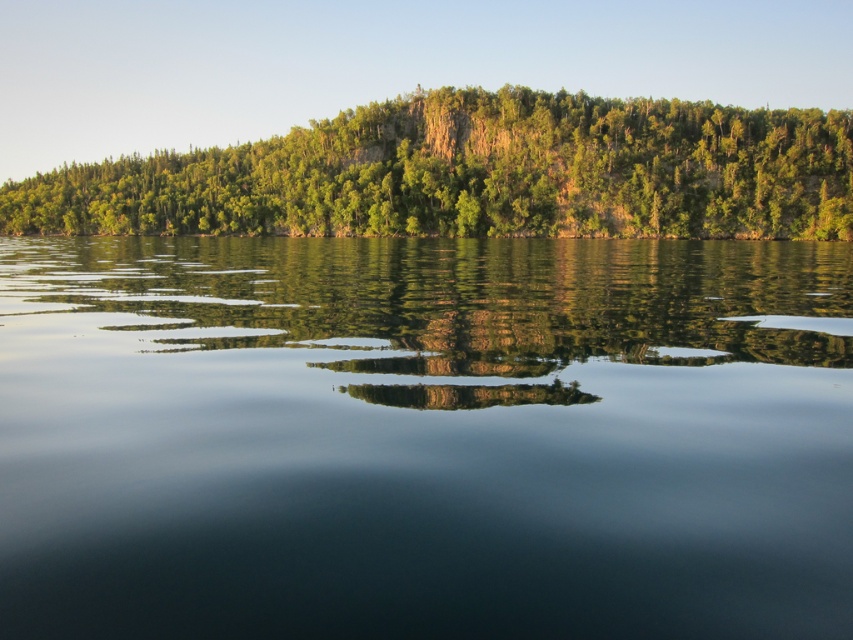
Is green reflective water at center positioned in front of green leafy trees at upper center?

Yes, it is.

Is green reflective water at center further to camera compared to green leafy trees at upper center?

No, it is not.

This screenshot has height=640, width=853. Identify the location of green reflective water at center. click(424, 436).